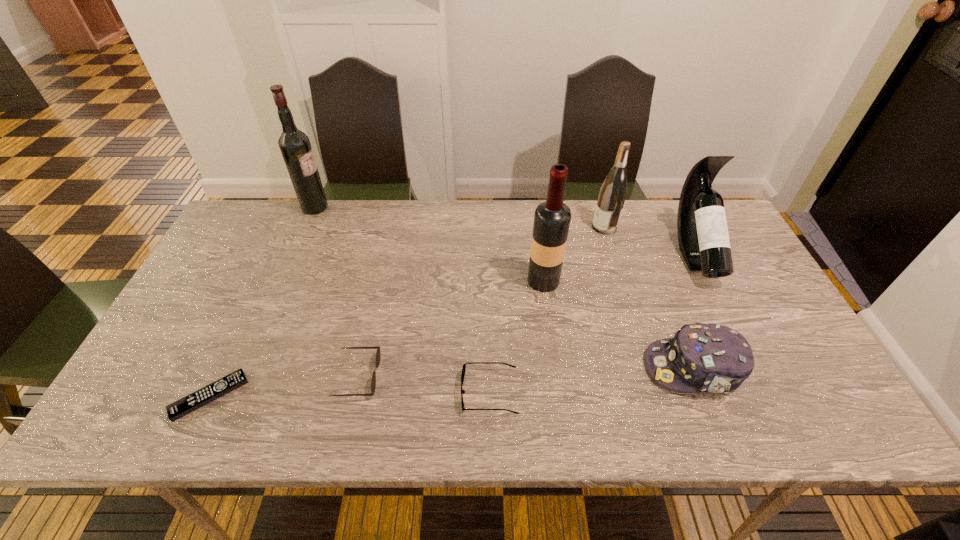
Identify the location of remote control. The height and width of the screenshot is (540, 960). (176, 410).

I want to click on vacant region located 0.180m on the front and back of the farthest object, so click(381, 207).

Identify the location of free spot located 0.120m on the left of the fifth object from left to right. (485, 281).

What are the coordinates of `vacant space situated on the back of the second wine bottle from right to left` in the screenshot? It's located at (599, 208).

The height and width of the screenshot is (540, 960). Find the location of `free region located 0.230m on the stand of the rightmost wine bottle`. free region located 0.230m on the stand of the rightmost wine bottle is located at coordinates (749, 363).

I want to click on vacant space situated 0.160m on the front-facing side of the headwear, so click(578, 368).

At what (x,y) coordinates should I click in order to perform the action: click on free region located on the front-facing side of the headwear. Please return your answer as a coordinate pair (x, y). The width and height of the screenshot is (960, 540). Looking at the image, I should click on (565, 368).

Locate an element on the screen. This screenshot has height=540, width=960. vacant area situated 0.340m on the front-facing side of the headwear is located at coordinates (503, 368).

Locate an element on the screen. vacant area located on the front-facing side of the sixth tallest object is located at coordinates (455, 376).

Where is `free space located 0.370m on the front-facing side of the fourth object from left to right`? The height and width of the screenshot is (540, 960). free space located 0.370m on the front-facing side of the fourth object from left to right is located at coordinates (300, 392).